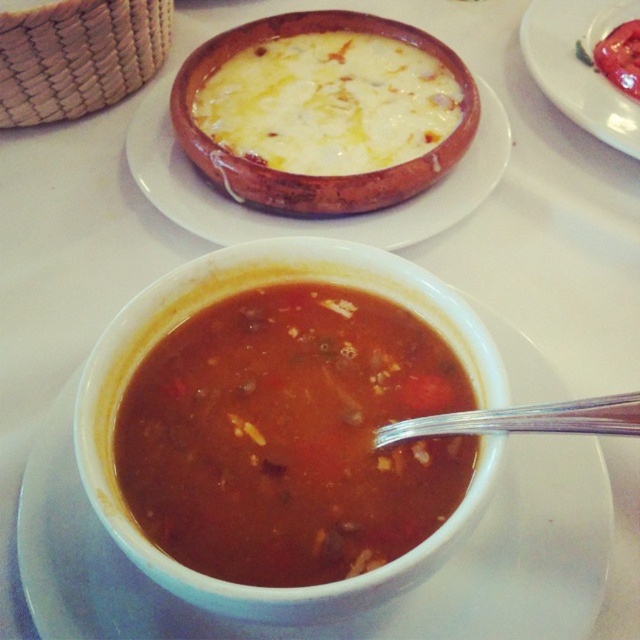
Can you confirm if matte clay bowl at upper center is smaller than tomato matte at upper right?

No.

Which is more to the left, matte clay bowl at upper center or tomato matte at upper right?

matte clay bowl at upper center

What do you see at coordinates (292, 218) in the screenshot?
I see `matte clay bowl at upper center` at bounding box center [292, 218].

This screenshot has width=640, height=640. Identify the location of matte clay bowl at upper center. (292, 218).

Does tomato matte at upper right have a larger size compared to tomato paste at upper right?

Yes.

The image size is (640, 640). Describe the element at coordinates (580, 65) in the screenshot. I see `tomato matte at upper right` at that location.

Is point (547, 3) more distant than point (612, 35)?

Yes.

Where is `tomato matte at upper right`? tomato matte at upper right is located at coordinates (580, 65).

Is brown matte bowl at center above tomato paste at upper right?

No.

Which is below, brown matte bowl at center or tomato paste at upper right?

brown matte bowl at center is below.

The image size is (640, 640). What do you see at coordinates (234, 292) in the screenshot?
I see `brown matte bowl at center` at bounding box center [234, 292].

Where is `brown matte bowl at center`? brown matte bowl at center is located at coordinates (234, 292).